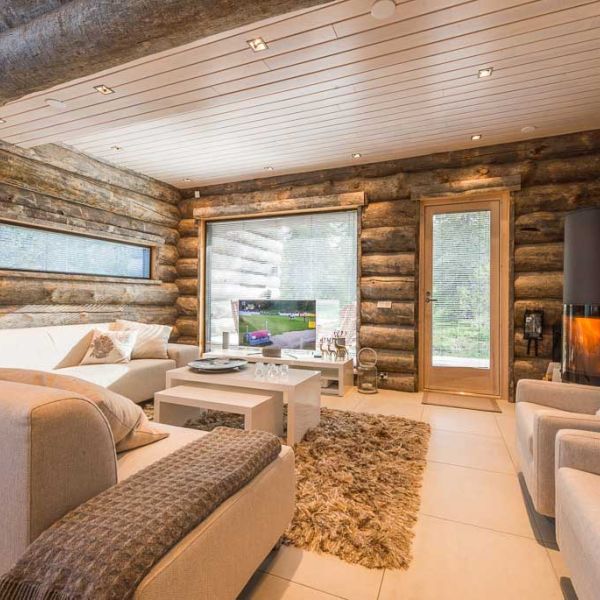
The height and width of the screenshot is (600, 600). In order to click on door handle and lock in this screenshot , I will do pos(427,289), pos(428,298).